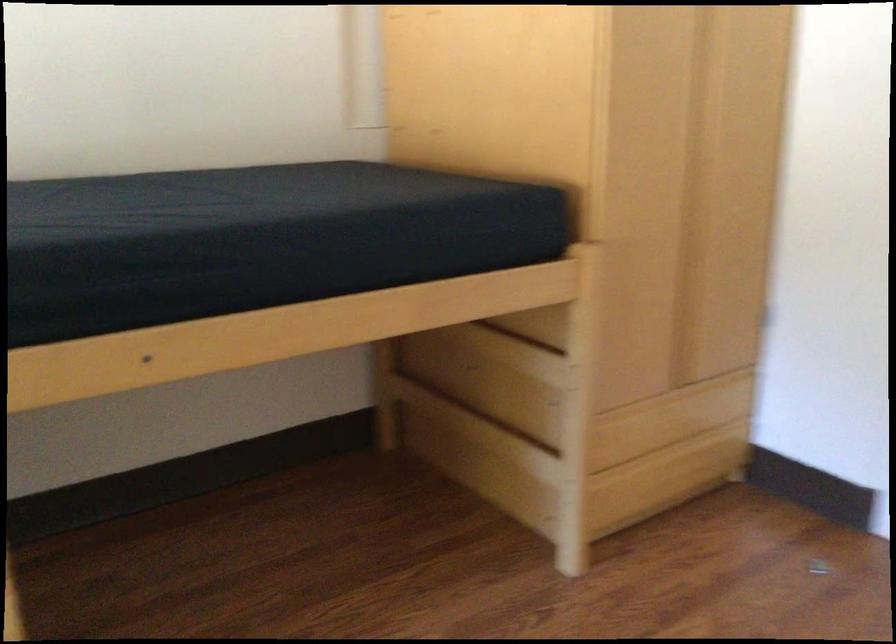
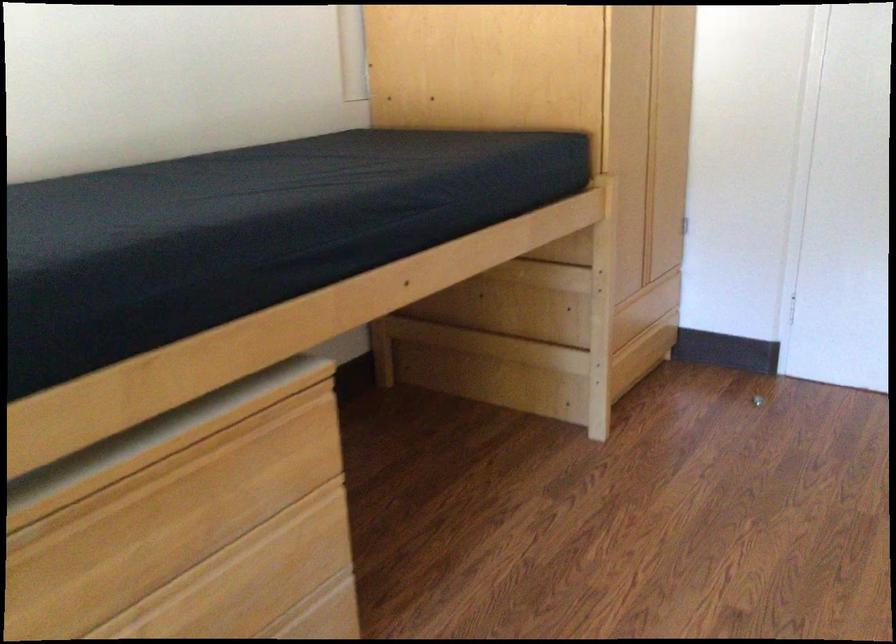
The point at (x=807, y=565) is marked in the first image. Where is the corresponding point in the second image?

(757, 400)